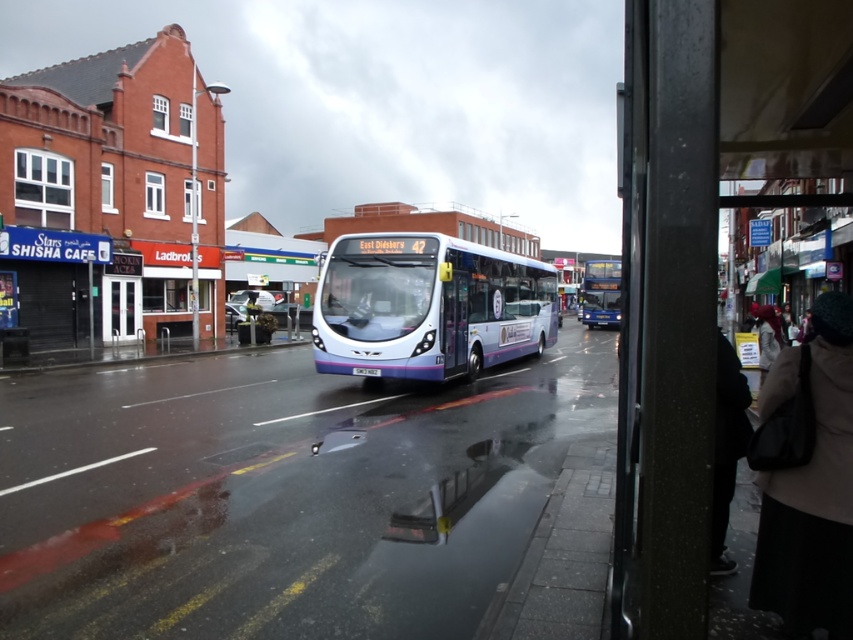
You are a pedestrian trying to decide whether to walk between the dark gray fabric jacket at lower right and the white fabric hat at lower right to reach the bus stop. Can you pass through the space between them?

The dark gray fabric jacket at lower right is positioned on the left side of the white fabric hat at lower right, so there is space between them. You can pass through the space between the dark gray fabric jacket at lower right and the white fabric hat at lower right to reach the bus stop.

You are a delivery person trying to deliver a package to the beige wool coat at lower right and the dark gray fabric jacket at lower right. The delivery robot has a maximum reach of 18 inches. Can the robot deliver the package to both individuals without moving closer?

The beige wool coat at lower right is 17.61 inches away from the dark gray fabric jacket at lower right. Since the distance is within the robot s 18 inch reach, the robot can deliver the package to both individuals without moving closer.

You are standing on the wet pavement at the bus stop on the right side of the frame. The white glossy bus at center is your destination. Given that you walk at a speed of 1.5 meters per second, how many seconds will it take you to reach the bus?

The distance between you and the white glossy bus at center is 12.61 meters. At a walking speed of 1.5 meters per second, it will take approximately 8.4 seconds to reach the bus.